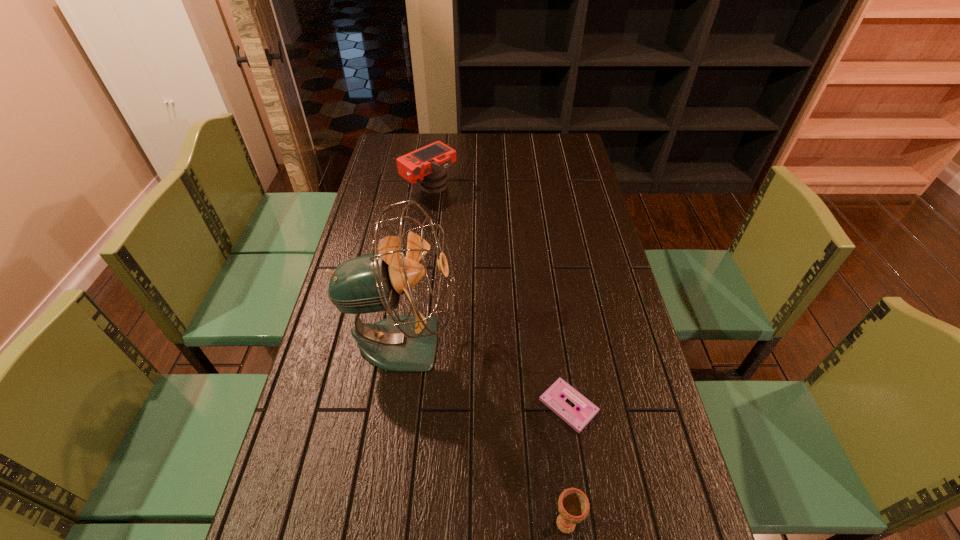
Where is `fan that is positioned at the left edge`? The height and width of the screenshot is (540, 960). fan that is positioned at the left edge is located at coordinates (370, 283).

The width and height of the screenshot is (960, 540). I want to click on camera that is at the left edge, so click(429, 164).

Locate an element on the screen. Image resolution: width=960 pixels, height=540 pixels. object situated at the right edge is located at coordinates (552, 397).

In the image, there is a desktop. Where is `free region at the far edge`? This screenshot has height=540, width=960. free region at the far edge is located at coordinates (492, 140).

The image size is (960, 540). Identify the location of free space at the right edge of the desktop. (563, 168).

At what (x,y) coordinates should I click in order to perform the action: click on free spot between the nearest object and the tallest object. Please return your answer as a coordinate pair (x, y). This screenshot has width=960, height=540. Looking at the image, I should click on (485, 433).

Where is `free space between the videotape and the camera`? This screenshot has height=540, width=960. free space between the videotape and the camera is located at coordinates click(x=499, y=297).

Find the location of a particular element. This screenshot has width=960, height=540. free space between the camera and the videotape is located at coordinates (499, 297).

Image resolution: width=960 pixels, height=540 pixels. What are the coordinates of `object that ranks as the closest to the nearest object` in the screenshot? It's located at (552, 397).

Point out which object is positioned as the third nearest to the tallest object. Please provide its 2D coordinates. Your answer should be formatted as a tuple, i.e. [(x, y)], where the tuple contains the x and y coordinates of a point satisfying the conditions above.

[(429, 164)]